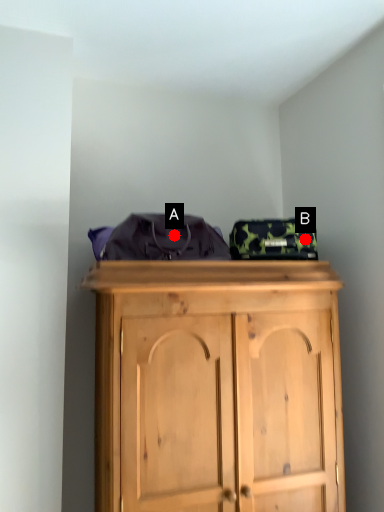
Question: Two points are circled on the image, labeled by A and B beside each circle. Which of the following is the farthest from the observer?

Choices:
 (A) A is further
 (B) B is further

Answer: (B)